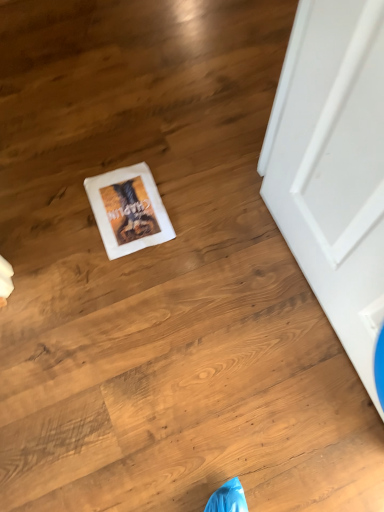
At what (x,y) coordinates should I click in order to perform the action: click on free space to the back side of white paper postcard at center. Please return your answer as a coordinate pair (x, y). This screenshot has height=512, width=384. Looking at the image, I should click on (131, 148).